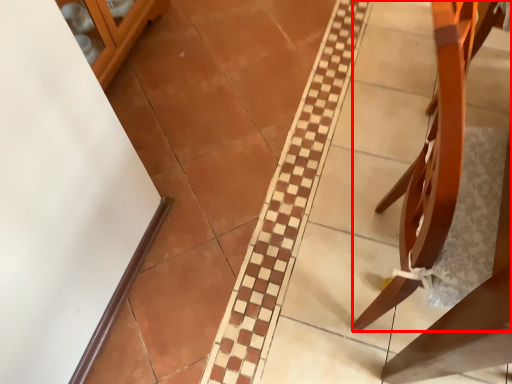
Question: In this image, where is furniture (annotated by the red box) located relative to glass door?

Choices:
 (A) right
 (B) left

Answer: (A)